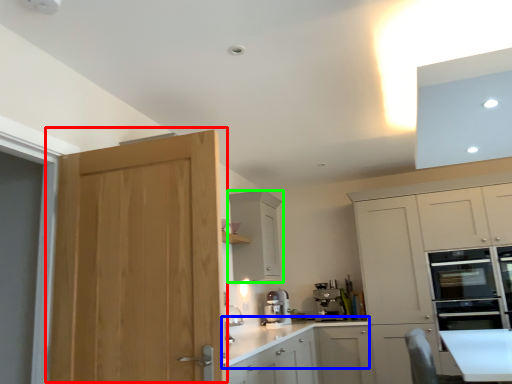
Question: Which object is positioned farthest from door (highlighted by a red box)? Select from countertop (highlighted by a blue box) and cabinetry (highlighted by a green box).

Choices:
 (A) countertop
 (B) cabinetry

Answer: (B)